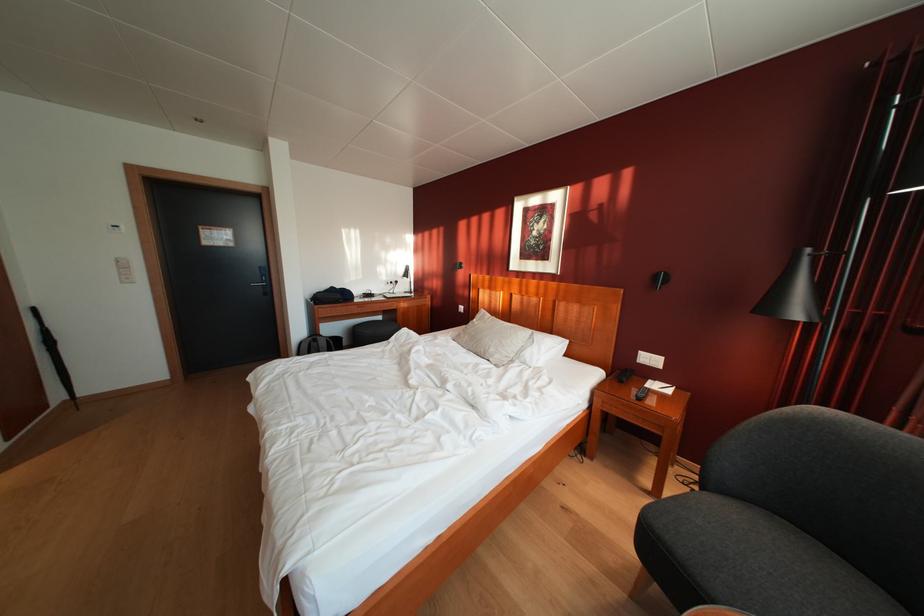
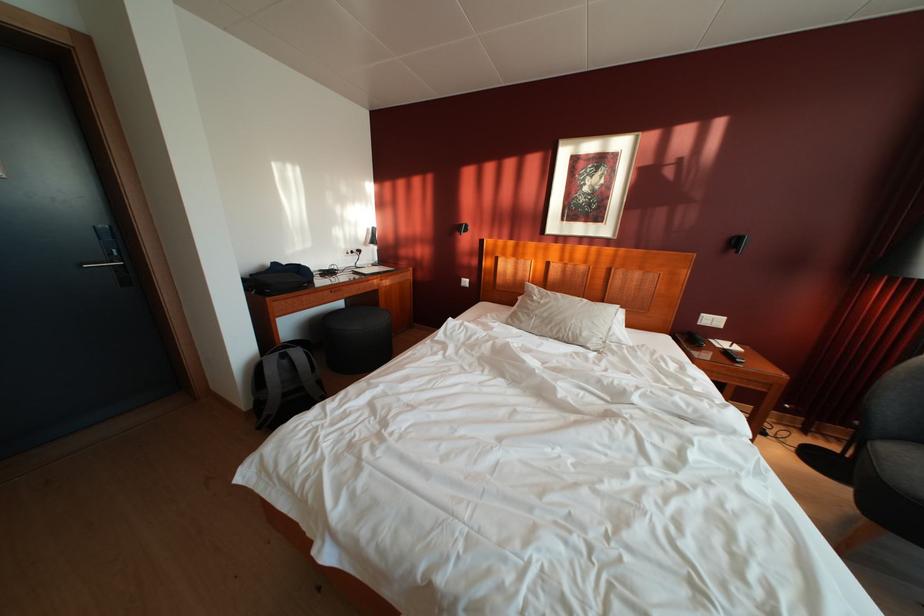
Locate, in the second image, the point that corresponds to point 500,357 in the first image.

(593, 339)